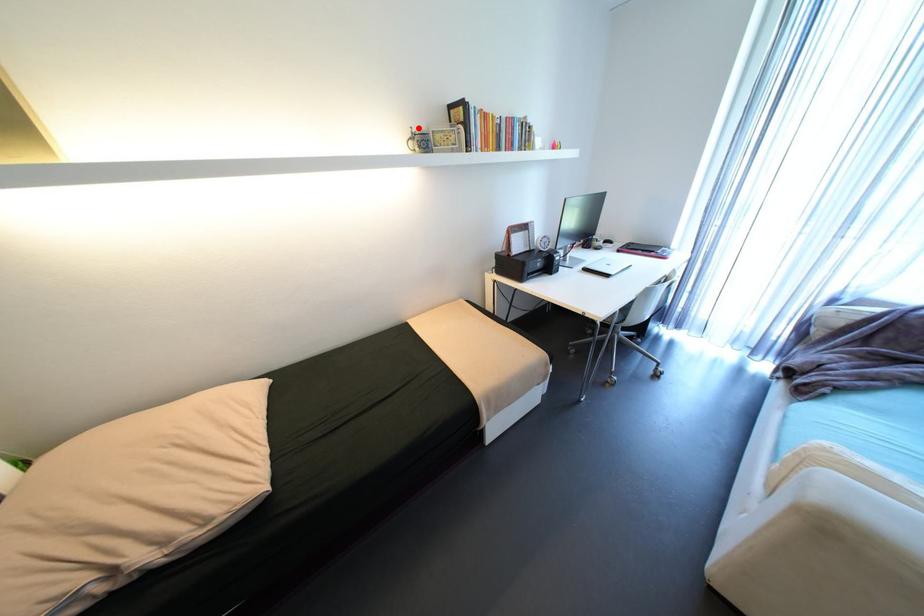
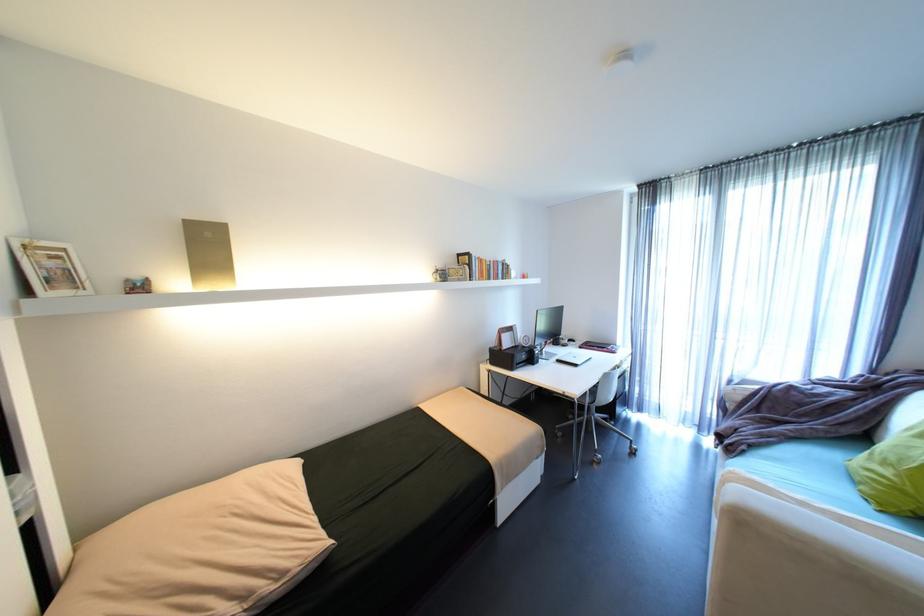
Find the pixel in the second image that matches the highlighted location in the first image.

(444, 267)